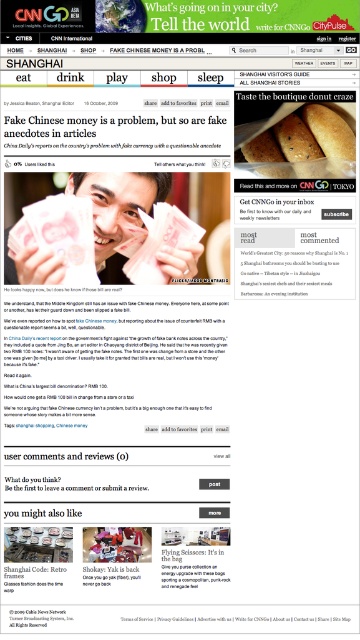
Question: Can you confirm if brown crumbly donut at upper right is bigger than matte brown donut at center?

Choices:
 (A) no
 (B) yes

Answer: (B)

Question: Is the position of brown crumbly donut at upper right more distant than that of matte brown donut at center?

Choices:
 (A) yes
 (B) no

Answer: (A)

Question: Which of the following is the closest to the observer?

Choices:
 (A) (315, 147)
 (B) (109, 547)

Answer: (B)

Question: Which point is closer to the camera?

Choices:
 (A) (266, 138)
 (B) (87, 540)

Answer: (B)

Question: Is brown crumbly donut at upper right wider than matte brown donut at center?

Choices:
 (A) no
 (B) yes

Answer: (B)